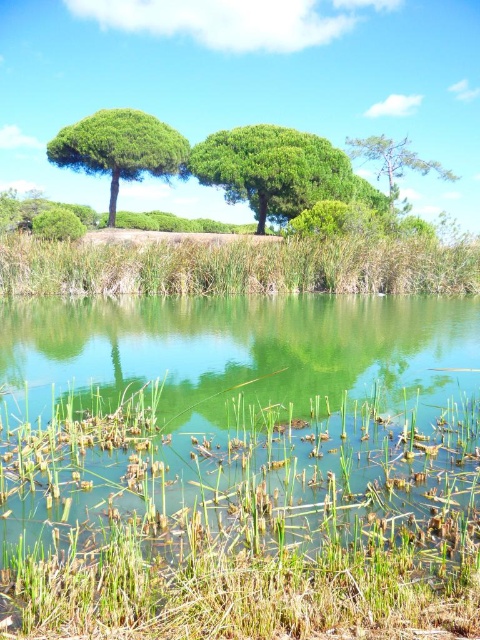
From the picture: You are standing in the natural scene and want to walk towards the green leafy tree at center and the green matte tree at upper left. Which tree will you reach first?

You will reach the green leafy tree at center first because it is closer to you than the green matte tree at upper left, which is further away.

In the scene shown: You are standing at the edge of the green grassy lake at bottom and want to walk towards the green grassy reed at lower center. Which direction should you move to reach it?

The green grassy reed at lower center is located above the green grassy lake at bottom, so you should move upward to reach it.